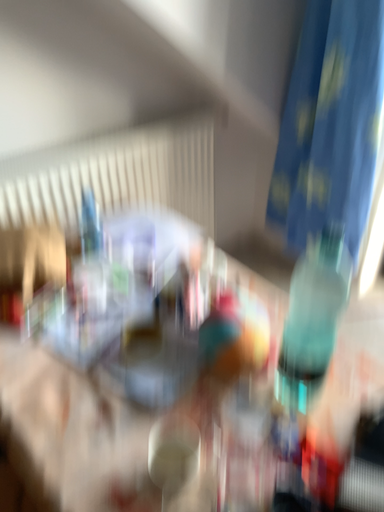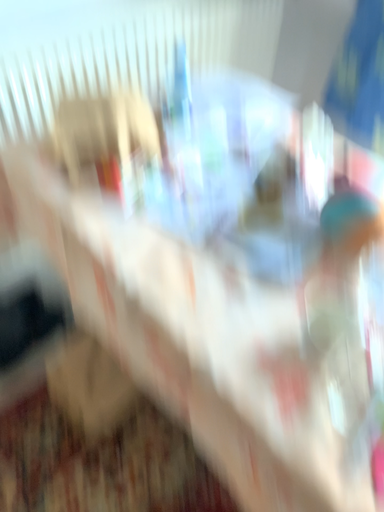
Question: Which way did the camera rotate in the video?

Choices:
 (A) rotated downward
 (B) rotated upward

Answer: (A)